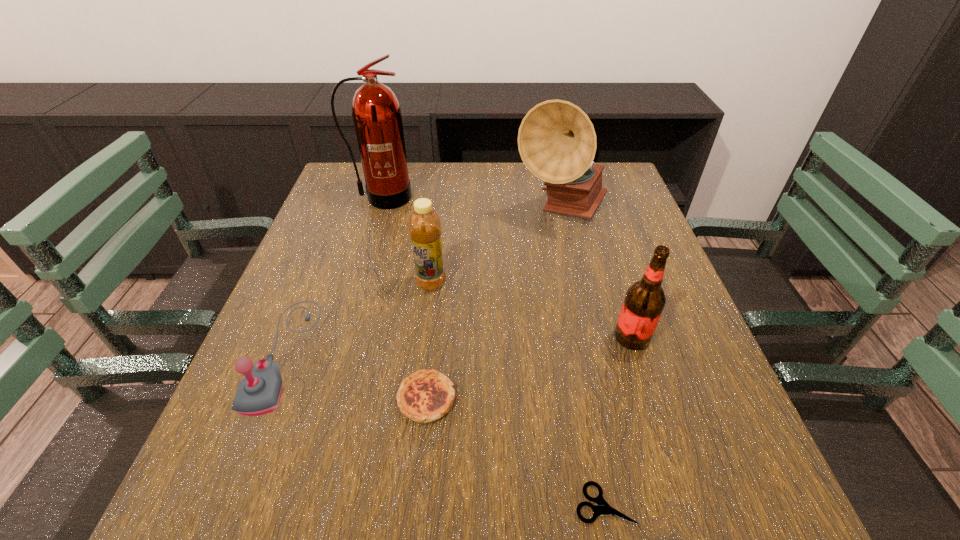
The height and width of the screenshot is (540, 960). Identify the location of vacant space situated on the front of the root beer. (670, 456).

Identify the location of free space located on the front of the bottle. Image resolution: width=960 pixels, height=540 pixels. (420, 368).

I want to click on vacant area located on the back of the fifth tallest object, so [x=329, y=240].

Identify the location of vacant point located on the left of the sixth tallest object. Image resolution: width=960 pixels, height=540 pixels. (234, 398).

At what (x,y) coordinates should I click in order to perform the action: click on vacant area situated on the left of the nearest object. Please return your answer as a coordinate pair (x, y). This screenshot has height=540, width=960. Looking at the image, I should click on point(357,504).

Identify the location of fire extinguisher situated at the far edge. (376, 112).

Where is `phonograph record that is at the far edge`? phonograph record that is at the far edge is located at coordinates (557, 142).

The width and height of the screenshot is (960, 540). I want to click on object present at the near edge, so click(602, 508).

At what (x,y) coordinates should I click in order to perform the action: click on fire extinguisher located at the left edge. Please return your answer as a coordinate pair (x, y). The width and height of the screenshot is (960, 540). Looking at the image, I should click on click(x=376, y=112).

Where is `joystick located at the left edge`? The width and height of the screenshot is (960, 540). joystick located at the left edge is located at coordinates (259, 392).